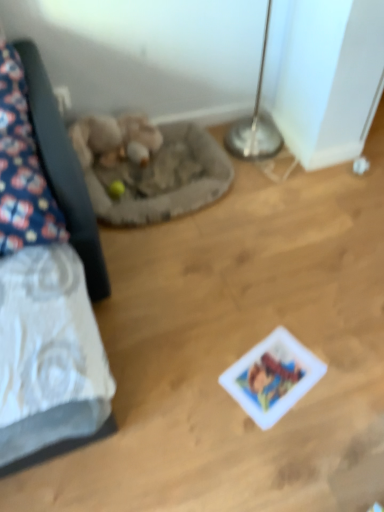
Question: Is fuzzy beige stuffed animal at center-left positioned before gray fabric cat bed at center-left?

Choices:
 (A) no
 (B) yes

Answer: (A)

Question: Can you confirm if fuzzy beige stuffed animal at center-left is bigger than gray fabric cat bed at center-left?

Choices:
 (A) no
 (B) yes

Answer: (A)

Question: Is fuzzy beige stuffed animal at center-left aimed at gray fabric cat bed at center-left?

Choices:
 (A) yes
 (B) no

Answer: (A)

Question: From a real-world perspective, is fuzzy beige stuffed animal at center-left physically above gray fabric cat bed at center-left?

Choices:
 (A) no
 (B) yes

Answer: (B)

Question: Does fuzzy beige stuffed animal at center-left have a greater width compared to gray fabric cat bed at center-left?

Choices:
 (A) no
 (B) yes

Answer: (A)

Question: Is gray fabric cat bed at center-left to the left or to the right of fuzzy beige stuffed animal at center-left in the image?

Choices:
 (A) right
 (B) left

Answer: (A)

Question: Considering their positions, is gray fabric cat bed at center-left located in front of or behind fuzzy beige stuffed animal at center-left?

Choices:
 (A) front
 (B) behind

Answer: (A)

Question: Based on their sizes in the image, would you say gray fabric cat bed at center-left is bigger or smaller than fuzzy beige stuffed animal at center-left?

Choices:
 (A) small
 (B) big

Answer: (B)

Question: Is gray fabric cat bed at center-left wider or thinner than fuzzy beige stuffed animal at center-left?

Choices:
 (A) thin
 (B) wide

Answer: (B)

Question: From the image's perspective, is gray fabric cat bed at center-left positioned above or below white glossy card at center?

Choices:
 (A) above
 (B) below

Answer: (A)

Question: Considering the relative positions of gray fabric cat bed at center-left and white glossy card at center in the image provided, is gray fabric cat bed at center-left to the left or to the right of white glossy card at center?

Choices:
 (A) left
 (B) right

Answer: (A)

Question: Considering their positions, is gray fabric cat bed at center-left located in front of or behind white glossy card at center?

Choices:
 (A) behind
 (B) front

Answer: (A)

Question: Is gray fabric cat bed at center-left taller or shorter than white glossy card at center?

Choices:
 (A) tall
 (B) short

Answer: (A)

Question: Is fuzzy beige stuffed animal at center-left bigger or smaller than white glossy card at center?

Choices:
 (A) small
 (B) big

Answer: (B)

Question: Is fuzzy beige stuffed animal at center-left to the left or to the right of white glossy card at center in the image?

Choices:
 (A) left
 (B) right

Answer: (A)